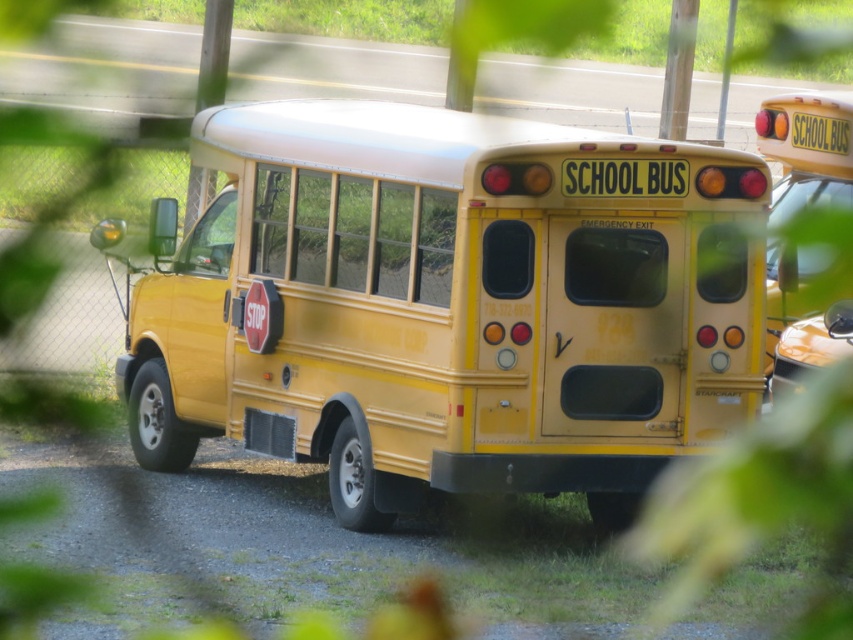
Between point (357, 472) and point (804, 365), which one is positioned behind?

The point (804, 365) is behind.

Does yellow matte school bus at center have a smaller size compared to yellow matte school bus at right?

Actually, yellow matte school bus at center might be larger than yellow matte school bus at right.

The image size is (853, 640). What do you see at coordinates (451, 305) in the screenshot?
I see `yellow matte school bus at center` at bounding box center [451, 305].

Where is `yellow matte school bus at center`? yellow matte school bus at center is located at coordinates (451, 305).